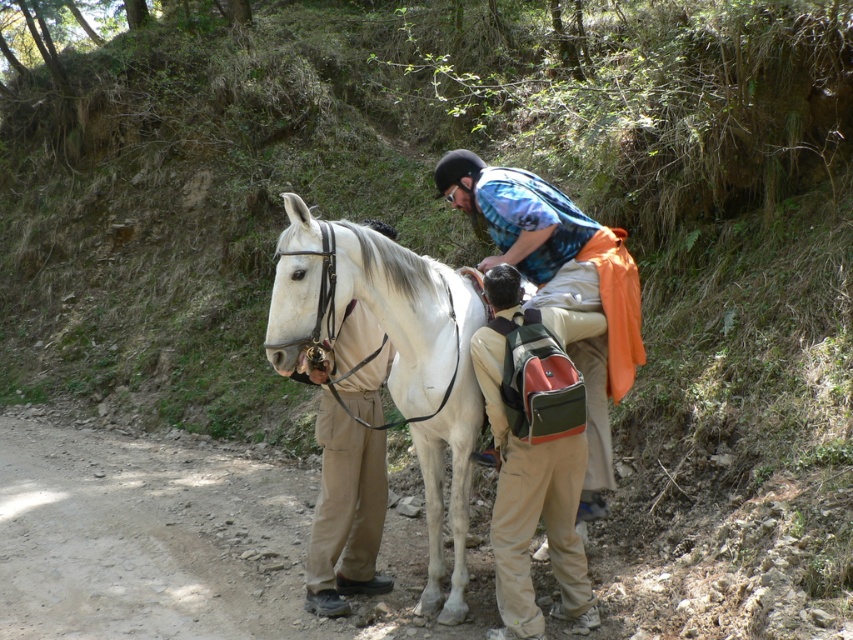
You are a photographer standing on the path in the scene. You want to take a photo that includes both the point at coordinates point [405,257] and point [532,401]. Which point should you focus on first to ensure both are in the frame?

You should focus on point [405,257] first because it is closer to you than point [532,401], ensuring both points are within the camera frame.

You are a photographer wanting to capture both the white glossy horse at center and the matte white pants at center in a single frame. Given their widths, which object should you position closer to the camera to ensure both fit within the frame?

Since the white glossy horse at center is wider than the matte white pants at center, you should position the wider white glossy horse at center closer to the camera to ensure both fit within the frame.